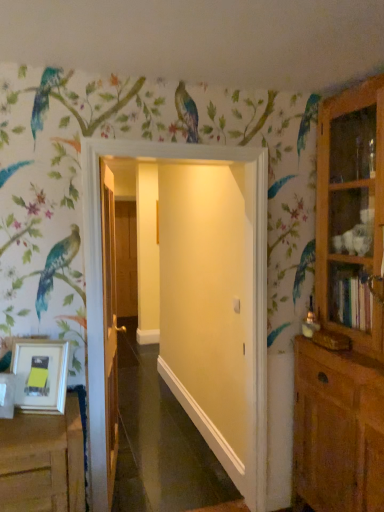
Question: Does wooden door at center, acting as the second door starting from the back, have a lesser height compared to brown wooden door at center, the third door viewed from the right?

Choices:
 (A) no
 (B) yes

Answer: (A)

Question: Can you confirm if wooden door at center, which is the 2th door in right-to-left order, is positioned to the right of brown wooden door at center, acting as the 3th door starting from the front?

Choices:
 (A) no
 (B) yes

Answer: (B)

Question: Is wooden door at center, which is counted as the second door, starting from the left, in contact with brown wooden door at center, acting as the 3th door starting from the front?

Choices:
 (A) no
 (B) yes

Answer: (A)

Question: Is brown wooden door at center, which appears as the 1th door when viewed from the left, completely or partially inside wooden door at center, which is the 2th door in right-to-left order?

Choices:
 (A) no
 (B) yes

Answer: (A)

Question: From the image's perspective, is wooden door at center, acting as the second door starting from the back, under brown wooden door at center, which appears as the 1th door when viewed from the left?

Choices:
 (A) no
 (B) yes

Answer: (B)

Question: From the image's perspective, is brown wooden door at center, acting as the 3th door starting from the front, located above or below wooden door at center, marked as the 2th door in a front-to-back arrangement?

Choices:
 (A) below
 (B) above

Answer: (B)

Question: Considering the positions of brown wooden door at center, acting as the 3th door starting from the front, and wooden door at center, marked as the 2th door in a front-to-back arrangement, in the image, is brown wooden door at center, acting as the 3th door starting from the front, wider or thinner than wooden door at center, marked as the 2th door in a front-to-back arrangement,?

Choices:
 (A) wide
 (B) thin

Answer: (B)

Question: Based on their sizes in the image, would you say brown wooden door at center, the third door viewed from the right, is bigger or smaller than wooden door at center, marked as the 2th door in a front-to-back arrangement?

Choices:
 (A) big
 (B) small

Answer: (B)

Question: Visually, is brown wooden door at center, which appears as the 1th door when viewed from the left, positioned to the left or to the right of wooden door at center, marked as the 2th door in a front-to-back arrangement?

Choices:
 (A) left
 (B) right

Answer: (A)

Question: Based on their sizes in the image, would you say wooden door at center, acting as the second door starting from the back, is bigger or smaller than white matte picture frame at lower left?

Choices:
 (A) big
 (B) small

Answer: (A)

Question: Looking at their shapes, would you say wooden door at center, acting as the second door starting from the back, is wider or thinner than white matte picture frame at lower left?

Choices:
 (A) thin
 (B) wide

Answer: (B)

Question: Is wooden door at center, marked as the 2th door in a front-to-back arrangement, taller or shorter than white matte picture frame at lower left?

Choices:
 (A) short
 (B) tall

Answer: (B)

Question: Is wooden door at center, which is the 2th door in right-to-left order, inside or outside of white matte picture frame at lower left?

Choices:
 (A) outside
 (B) inside

Answer: (A)

Question: Considering the positions of wooden door at center, marked as the 2th door in a front-to-back arrangement, and wooden cabinet at right in the image, is wooden door at center, marked as the 2th door in a front-to-back arrangement, bigger or smaller than wooden cabinet at right?

Choices:
 (A) big
 (B) small

Answer: (B)

Question: Visually, is wooden door at center, which is counted as the second door, starting from the left, positioned to the left or to the right of wooden cabinet at right?

Choices:
 (A) left
 (B) right

Answer: (A)